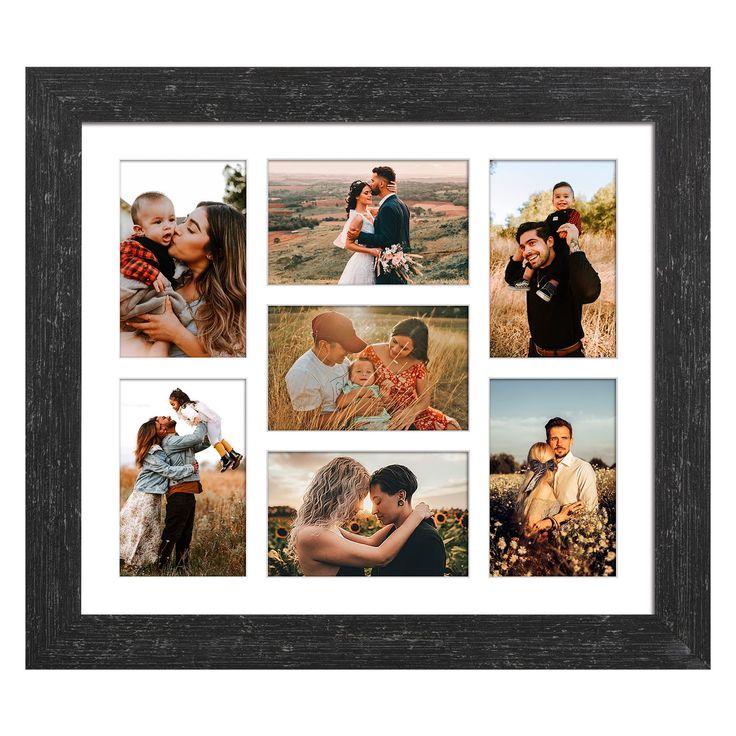
Find the location of a particular element. This screenshot has width=736, height=736. photographs is located at coordinates (198, 252), (369, 213), (556, 263), (383, 382), (210, 480), (397, 500), (517, 445).